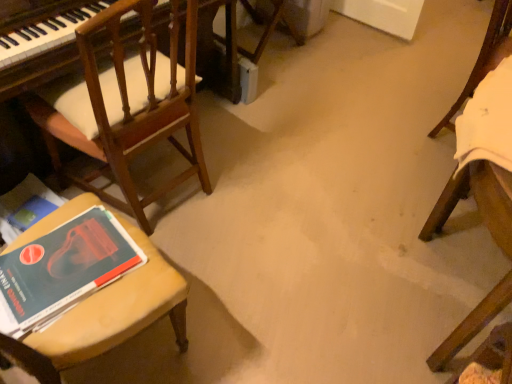
In order to face wooden chair at left, placed as the 2th chair when sorted from right to left, should I rotate leftwards or rightwards?

Turn left approximately 16.557 degrees to face it.

Identify the location of white fabric chair at right, arranged as the 1th chair when viewed from the right. (484, 58).

Locate an element on the screen. The width and height of the screenshot is (512, 384). hardcover book at lower left is located at coordinates (64, 268).

In order to click on wooden chair at left, placed as the 2th chair when sorted from right to left in this screenshot , I will do `click(125, 105)`.

Does point (128, 90) lie behind point (64, 268)?

Yes.

Is wooden chair at left, placed as the 2th chair when sorted from right to left, inside the boundaries of hardcover book at lower left, or outside?

The correct answer is: outside.

Consider the image. Is wooden chair at left, acting as the first chair starting from the left, oriented away from hardcover book at lower left?

No, wooden chair at left, acting as the first chair starting from the left,'s orientation is not away from hardcover book at lower left.

Based on the photo, considering the positions of objects wooden chair at left, placed as the 2th chair when sorted from right to left, and hardcover book at lower left in the image provided, who is in front, wooden chair at left, placed as the 2th chair when sorted from right to left, or hardcover book at lower left?

hardcover book at lower left is closer to the camera.

Between hardcover book at lower left and white fabric chair at right, the second chair positioned from the left, which one has smaller size?

hardcover book at lower left is smaller.

Consider the image. From the image's perspective, is hardcover book at lower left located above or below white fabric chair at right, the second chair positioned from the left?

Clearly, from the image's perspective, hardcover book at lower left is below white fabric chair at right, the second chair positioned from the left.

Is point (97, 270) positioned after point (461, 103)?

No, it is not.

Is hardcover book at lower left wider than white fabric chair at right, the second chair positioned from the left?

Indeed, hardcover book at lower left has a greater width compared to white fabric chair at right, the second chair positioned from the left.

Considering the sizes of objects white fabric chair at right, arranged as the 1th chair when viewed from the right, and hardcover book at lower left in the image provided, who is taller, white fabric chair at right, arranged as the 1th chair when viewed from the right, or hardcover book at lower left?

With more height is white fabric chair at right, arranged as the 1th chair when viewed from the right.

Is white fabric chair at right, the second chair positioned from the left, with hardcover book at lower left?

white fabric chair at right, the second chair positioned from the left, and hardcover book at lower left are not in contact.

Based on the photo, which is less distant, (486,32) or (25,267)?

Point (486,32) is positioned farther from the camera compared to point (25,267).

The width and height of the screenshot is (512, 384). I want to click on the 2nd chair behind the hardcover book at lower left, starting your count from the anchor, so click(484, 58).

Can you confirm if wooden chair at left, placed as the 2th chair when sorted from right to left, is bigger than white fabric chair at right, the second chair positioned from the left?

Yes, wooden chair at left, placed as the 2th chair when sorted from right to left, is bigger than white fabric chair at right, the second chair positioned from the left.

Which is less distant, (160,124) or (498,31)?

Point (160,124) is positioned closer to the camera compared to point (498,31).

Locate an element on the screen. The width and height of the screenshot is (512, 384). chair located on the right of wooden chair at left, acting as the first chair starting from the left is located at coordinates (484, 58).

Is wooden chair at left, placed as the 2th chair when sorted from right to left, wider than white fabric chair at right, the second chair positioned from the left?

Yes.

Which point is more forward, [461,99] or [187,35]?

The point [187,35] is more forward.

Identify the location of chair above the wooden chair at left, placed as the 2th chair when sorted from right to left (from the image's perspective). The width and height of the screenshot is (512, 384). (484, 58).

Is white fabric chair at right, the second chair positioned from the left, oriented away from wooden chair at left, acting as the first chair starting from the left?

That's not correct — white fabric chair at right, the second chair positioned from the left, is not looking away from wooden chair at left, acting as the first chair starting from the left.

Is white fabric chair at right, arranged as the 1th chair when viewed from the right, inside the boundaries of wooden chair at left, acting as the first chair starting from the left, or outside?

white fabric chair at right, arranged as the 1th chair when viewed from the right, lies outside wooden chair at left, acting as the first chair starting from the left.

Is hardcover book at lower left inside or outside of wooden chair at left, acting as the first chair starting from the left?

hardcover book at lower left is located beyond the bounds of wooden chair at left, acting as the first chair starting from the left.

Considering the sizes of hardcover book at lower left and wooden chair at left, placed as the 2th chair when sorted from right to left, in the image, is hardcover book at lower left bigger or smaller than wooden chair at left, placed as the 2th chair when sorted from right to left,?

In the image, hardcover book at lower left appears to be smaller than wooden chair at left, placed as the 2th chair when sorted from right to left.

Can you confirm if hardcover book at lower left is positioned to the right of wooden chair at left, placed as the 2th chair when sorted from right to left?

No, hardcover book at lower left is not to the right of wooden chair at left, placed as the 2th chair when sorted from right to left.

Could you tell me if hardcover book at lower left is turned towards wooden chair at left, acting as the first chair starting from the left?

No, hardcover book at lower left does not turn towards wooden chair at left, acting as the first chair starting from the left.

You are a GUI agent. You are given a task and a screenshot of the screen. Output one action in this format:
    pyautogui.click(x=<x>, y=<y>)
    Task: Click on the 1st chair to the right of the hardcover book at lower left, counting from the anchor's position
    Image resolution: width=512 pixels, height=384 pixels.
    Given the screenshot: What is the action you would take?
    pyautogui.click(x=125, y=105)

At what (x,y) coordinates should I click in order to perform the action: click on book on the left of white fabric chair at right, arranged as the 1th chair when viewed from the right. Please return your answer as a coordinate pair (x, y). This screenshot has height=384, width=512. Looking at the image, I should click on (64, 268).

Estimate the real-world distances between objects in this image. Which object is further from white fabric chair at right, arranged as the 1th chair when viewed from the right, wooden chair at left, acting as the first chair starting from the left, or hardcover book at lower left?

hardcover book at lower left.

From the image, which object appears to be farther from wooden chair at left, placed as the 2th chair when sorted from right to left, white fabric chair at right, arranged as the 1th chair when viewed from the right, or hardcover book at lower left?

Based on the image, white fabric chair at right, arranged as the 1th chair when viewed from the right, appears to be further to wooden chair at left, placed as the 2th chair when sorted from right to left.

Looking at the image, which one is located closer to hardcover book at lower left, white fabric chair at right, the second chair positioned from the left, or wooden chair at left, placed as the 2th chair when sorted from right to left?

wooden chair at left, placed as the 2th chair when sorted from right to left.

Looking at the image, which one is located further to wooden chair at left, placed as the 2th chair when sorted from right to left, hardcover book at lower left or white fabric chair at right, arranged as the 1th chair when viewed from the right?

The object further to wooden chair at left, placed as the 2th chair when sorted from right to left, is white fabric chair at right, arranged as the 1th chair when viewed from the right.

Estimate the real-world distances between objects in this image. Which object is further from hardcover book at lower left, wooden chair at left, placed as the 2th chair when sorted from right to left, or white fabric chair at right, arranged as the 1th chair when viewed from the right?

The object further to hardcover book at lower left is white fabric chair at right, arranged as the 1th chair when viewed from the right.

From the image, which object appears to be nearer to white fabric chair at right, the second chair positioned from the left, hardcover book at lower left or wooden chair at left, placed as the 2th chair when sorted from right to left?

wooden chair at left, placed as the 2th chair when sorted from right to left, is closer to white fabric chair at right, the second chair positioned from the left.

You are a GUI agent. You are given a task and a screenshot of the screen. Output one action in this format:
    pyautogui.click(x=<x>, y=<y>)
    Task: Click on the chair between hardcover book at lower left and white fabric chair at right, the second chair positioned from the left, in the horizontal direction
    This screenshot has height=384, width=512.
    Given the screenshot: What is the action you would take?
    pyautogui.click(x=125, y=105)